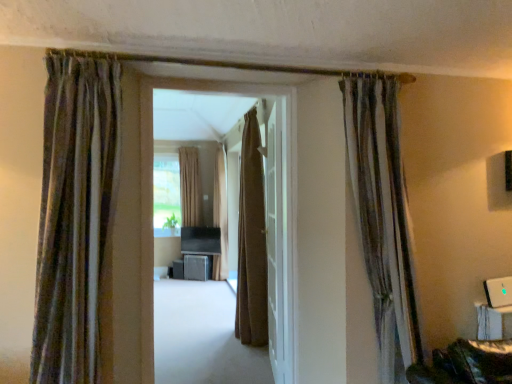
This screenshot has width=512, height=384. What do you see at coordinates (220, 215) in the screenshot?
I see `brown textured curtain at center, positioned as the 4th curtain in front-to-back order` at bounding box center [220, 215].

This screenshot has height=384, width=512. What do you see at coordinates (279, 235) in the screenshot? I see `white glossy door at center` at bounding box center [279, 235].

What do you see at coordinates (271, 204) in the screenshot?
I see `matte brown carpet at center` at bounding box center [271, 204].

Find the location of a particular element. Image resolution: width=512 pixels, height=384 pixels. brown textured curtain at center, the 3th curtain viewed from the left is located at coordinates (220, 215).

Is matte brown carpet at center not close to brown fabric curtain at center, the 3th curtain from the front?

matte brown carpet at center is near brown fabric curtain at center, the 3th curtain from the front, not far away.

Between matte brown carpet at center and brown fabric curtain at center, the 3th curtain from the front, which one appears on the right side from the viewer's perspective?

From the viewer's perspective, brown fabric curtain at center, the 3th curtain from the front, appears more on the right side.

From a real-world perspective, is matte brown carpet at center physically below brown fabric curtain at center, the 4th curtain positioned from the left?

Correct, in the physical world, matte brown carpet at center is lower than brown fabric curtain at center, the 4th curtain positioned from the left.

Looking at this image, is matte brown carpet at center facing towards brown fabric curtain at center, the 4th curtain positioned from the left?

No, matte brown carpet at center is not turned towards brown fabric curtain at center, the 4th curtain positioned from the left.

Considering their positions, is matte brown carpet at center located in front of or behind beige fabric curtain at center, the first curtain positioned from the left?

In the image, matte brown carpet at center appears in front of beige fabric curtain at center, the first curtain positioned from the left.

From a real-world perspective, starting from the matte brown carpet at center, which curtain is the 5th one vertically above it? Please provide its 2D coordinates.

[(190, 187)]

Does matte brown carpet at center have a lesser height compared to beige fabric curtain at center, the fifth curtain viewed from the right?

In fact, matte brown carpet at center may be taller than beige fabric curtain at center, the fifth curtain viewed from the right.

Does matte brown carpet at center turn towards beige fabric curtain at center, the first curtain positioned from the left?

No, matte brown carpet at center does not turn towards beige fabric curtain at center, the first curtain positioned from the left.

Is point (48, 64) closer to camera compared to point (415, 308)?

Yes, point (48, 64) is closer to viewer.

Between striped velvet curtain at left, which is the first curtain in front-to-back order, and textured brown curtain at right, the fifth curtain from the left, which one has larger size?

striped velvet curtain at left, which is the first curtain in front-to-back order.

Is striped velvet curtain at left, which is the first curtain in front-to-back order, to the left of textured brown curtain at right, positioned as the second curtain in front-to-back order, from the viewer's perspective?

Yes, striped velvet curtain at left, which is the first curtain in front-to-back order, is to the left of textured brown curtain at right, positioned as the second curtain in front-to-back order.

From a real-world perspective, which is physically below, striped velvet curtain at left, which appears as the fourth curtain when viewed from the right, or textured brown curtain at right, placed as the first curtain when sorted from right to left?

textured brown curtain at right, placed as the first curtain when sorted from right to left, from a real-world perspective.

Considering the sizes of brown textured curtain at center, the 3th curtain viewed from the left, and beige fabric curtain at center, which appears as the 1th curtain when viewed from the back, in the image, is brown textured curtain at center, the 3th curtain viewed from the left, taller or shorter than beige fabric curtain at center, which appears as the 1th curtain when viewed from the back,?

Considering their sizes, brown textured curtain at center, the 3th curtain viewed from the left, has more height than beige fabric curtain at center, which appears as the 1th curtain when viewed from the back.

From the image's perspective, would you say brown textured curtain at center, positioned as the 4th curtain in front-to-back order, is shown under beige fabric curtain at center, the fifth curtain viewed from the right?

Correct, brown textured curtain at center, positioned as the 4th curtain in front-to-back order, appears lower than beige fabric curtain at center, the fifth curtain viewed from the right, in the image.

Is there a large distance between brown textured curtain at center, the second curtain in the back-to-front sequence, and beige fabric curtain at center, which is the 5th curtain from front to back?

No.

Considering the sizes of objects striped velvet curtain at left, which appears as the fourth curtain when viewed from the right, and matte brown carpet at center in the image provided, who is taller, striped velvet curtain at left, which appears as the fourth curtain when viewed from the right, or matte brown carpet at center?

matte brown carpet at center is taller.

Is striped velvet curtain at left, which is the first curtain in front-to-back order, positioned beyond the bounds of matte brown carpet at center?

Yes, striped velvet curtain at left, which is the first curtain in front-to-back order, is not within matte brown carpet at center.

From the image's perspective, is striped velvet curtain at left, which is the fifth curtain in back-to-front order, over matte brown carpet at center?

Yes, from the image's perspective, striped velvet curtain at left, which is the fifth curtain in back-to-front order, is over matte brown carpet at center.

Considering the positions of point (75, 314) and point (273, 238), is point (75, 314) closer or farther from the camera than point (273, 238)?

Point (75, 314).

Is beige fabric curtain at center, which is the 5th curtain from front to back, wider than brown textured curtain at center, positioned as the 4th curtain in front-to-back order?

No.

Locate an element on the screen. The image size is (512, 384). curtain behind the brown textured curtain at center, the third curtain in the right-to-left sequence is located at coordinates (190, 187).

From the image's perspective, which object appears higher, beige fabric curtain at center, which is the 5th curtain from front to back, or brown textured curtain at center, the second curtain in the back-to-front sequence?

beige fabric curtain at center, which is the 5th curtain from front to back.

Is beige fabric curtain at center, the fifth curtain viewed from the right, facing away from brown textured curtain at center, the 3th curtain viewed from the left?

beige fabric curtain at center, the fifth curtain viewed from the right, does not have its back to brown textured curtain at center, the 3th curtain viewed from the left.

Is striped velvet curtain at left, which is the fifth curtain in back-to-front order, spatially inside brown fabric curtain at center, arranged as the second curtain when viewed from the right, or outside of it?

striped velvet curtain at left, which is the fifth curtain in back-to-front order, is spatially situated outside brown fabric curtain at center, arranged as the second curtain when viewed from the right.

Which of these two, striped velvet curtain at left, which is the fifth curtain in back-to-front order, or brown fabric curtain at center, the 3th curtain from the front, is thinner?

striped velvet curtain at left, which is the fifth curtain in back-to-front order.

What's the angular difference between striped velvet curtain at left, which is the first curtain in front-to-back order, and brown fabric curtain at center, arranged as the second curtain when viewed from the right,'s facing directions?

The angle between the facing direction of striped velvet curtain at left, which is the first curtain in front-to-back order, and the facing direction of brown fabric curtain at center, arranged as the second curtain when viewed from the right, is 92.4 degrees.

Does point (85, 327) appear closer or farther from the camera than point (244, 116)?

Point (85, 327).

Identify the location of the 1st curtain to the right of the matte brown carpet at center, starting your count from the anchor. The image size is (512, 384). (251, 241).

The height and width of the screenshot is (384, 512). There is a matte brown carpet at center. What are the coordinates of `the 5th curtain above it (from the image's perspective)` in the screenshot? It's located at (190, 187).

Which object lies nearer to the anchor point matte brown carpet at center, textured brown curtain at right, the fifth curtain from the left, or metallic gray cabinet at center, which appears as the 2th furniture when viewed from the left?

Among the two, textured brown curtain at right, the fifth curtain from the left, is located nearer to matte brown carpet at center.

Based on their spatial positions, is textured brown curtain at right, the fifth curtain from the left, or matte brown carpet at center closer to beige fabric curtain at center, which is the 5th curtain from front to back?

matte brown carpet at center.

Considering their positions, is white glossy door at center positioned closer to matte black speaker at center, arranged as the 2th furniture when viewed from the right, than brown fabric curtain at center, the 3th curtain from the front?

The object closer to matte black speaker at center, arranged as the 2th furniture when viewed from the right, is brown fabric curtain at center, the 3th curtain from the front.

When comparing their distances from matte brown carpet at center, does metallic gray cabinet at center, the 1th furniture in the right-to-left sequence, or white glossy door at center seem closer?

white glossy door at center lies closer to matte brown carpet at center than the other object.

Estimate the real-world distances between objects in this image. Which object is closer to beige fabric curtain at center, which is the 5th curtain from front to back, white glossy door at center or matte black speaker at center, the first furniture from the left?

matte black speaker at center, the first furniture from the left, is positioned closer to the anchor beige fabric curtain at center, which is the 5th curtain from front to back.

From the image, which object appears to be farther from matte black speaker at center, the first furniture from the left, matte brown carpet at center or metallic gray cabinet at center, which appears as the 2th furniture when viewed from the left?

matte brown carpet at center is further to matte black speaker at center, the first furniture from the left.

Estimate the real-world distances between objects in this image. Which object is further from matte black speaker at center, arranged as the 2th furniture when viewed from the right, matte brown carpet at center or brown fabric curtain at center, arranged as the second curtain when viewed from the right?

Based on the image, matte brown carpet at center appears to be further to matte black speaker at center, arranged as the 2th furniture when viewed from the right.

Which object lies nearer to the anchor point striped velvet curtain at left, which is the fifth curtain in back-to-front order, white glossy door at center or metallic gray cabinet at center, the 1th furniture in the right-to-left sequence?

white glossy door at center lies closer to striped velvet curtain at left, which is the fifth curtain in back-to-front order, than the other object.

Where is `corridor located between striped velvet curtain at left, the second curtain from the left, and textured brown curtain at right, positioned as the second curtain in front-to-back order, in the left-right direction`? corridor located between striped velvet curtain at left, the second curtain from the left, and textured brown curtain at right, positioned as the second curtain in front-to-back order, in the left-right direction is located at coordinates (271, 204).

At what (x,y) coordinates should I click in order to perform the action: click on furniture between textured brown curtain at right, the fifth curtain from the left, and matte black speaker at center, the first furniture from the left, in the front-back direction. Please return your answer as a coordinate pair (x, y). This screenshot has width=512, height=384. Looking at the image, I should click on (197, 267).

This screenshot has height=384, width=512. Identify the location of corridor located between textured brown curtain at right, the fifth curtain from the left, and beige fabric curtain at center, which is the 5th curtain from front to back, in the depth direction. (271, 204).

Identify the location of door located between textured brown curtain at right, the fifth curtain from the left, and beige fabric curtain at center, the first curtain positioned from the left, in the depth direction. Image resolution: width=512 pixels, height=384 pixels. (279, 235).